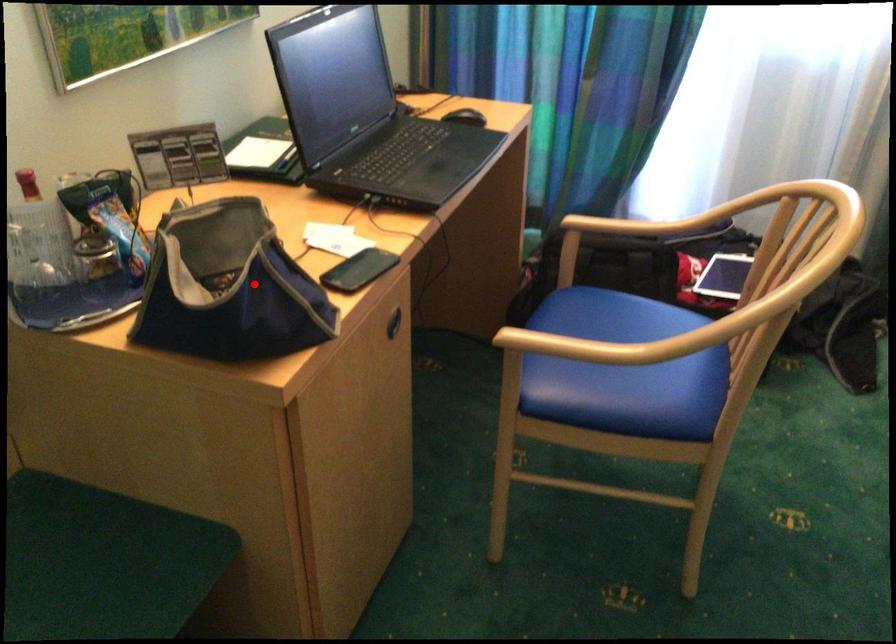
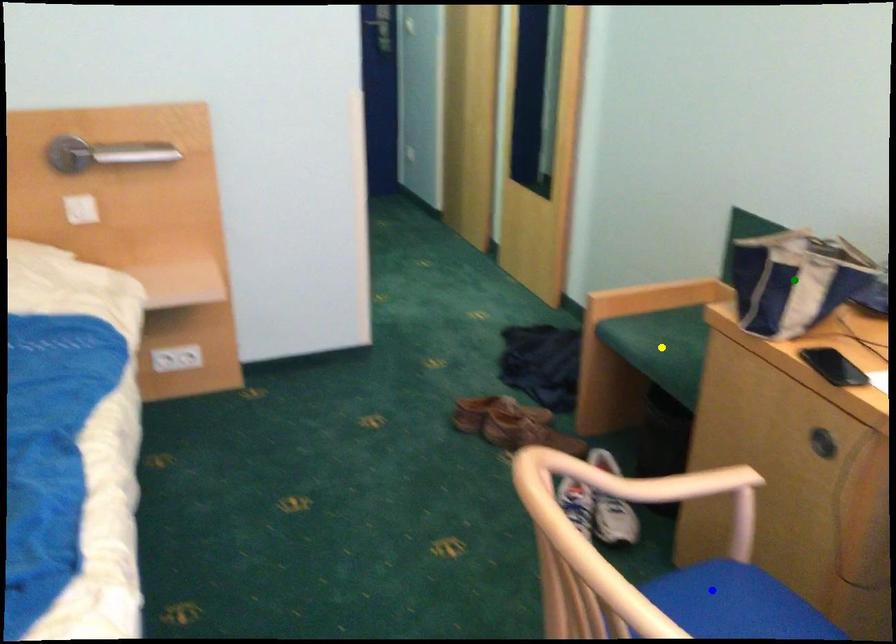
Question: I am providing you with two images of the same scene from different viewpoints. A red point is marked on the first image. You are given multiple points on the second image. Which spot in image 2 lines up with the point in image 1?

Choices:
 (A) green point
 (B) yellow point
 (C) blue point

Answer: (A)